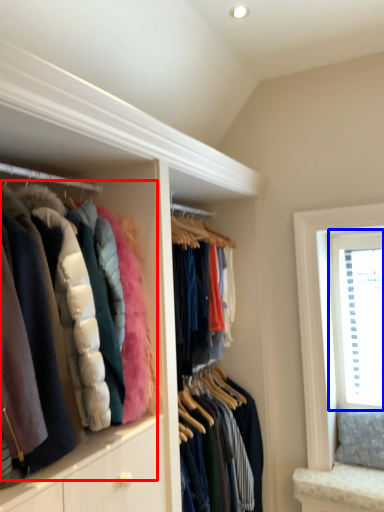
Question: Which object appears farthest to the camera in this image, jacket (highlighted by a red box) or window (highlighted by a blue box)?

Choices:
 (A) jacket
 (B) window

Answer: (B)